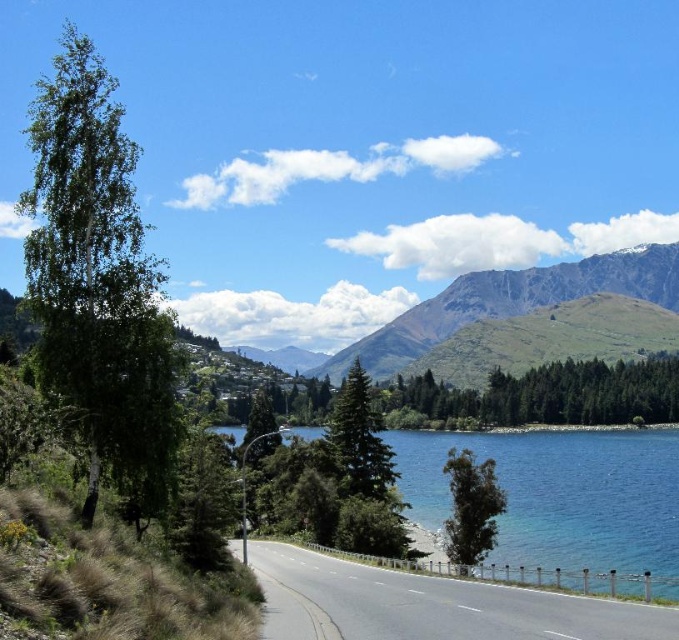
Does green matte tree at left appear on the right side of green textured mountain at upper center?

In fact, green matte tree at left is to the left of green textured mountain at upper center.

Between point (69, 234) and point (409, 340), which one is positioned behind?

Positioned behind is point (409, 340).

Who is more distant from viewer, (x=172, y=422) or (x=447, y=332)?

Positioned behind is point (x=447, y=332).

This screenshot has width=679, height=640. In order to click on green matte tree at left in this screenshot , I will do `click(98, 282)`.

Can you confirm if blue glassy water at center is bigger than green textured tree at center?

Actually, blue glassy water at center might be smaller than green textured tree at center.

Where is `blue glassy water at center`? This screenshot has width=679, height=640. blue glassy water at center is located at coordinates (562, 502).

Does blue glassy water at center appear on the left side of green textured mountain at upper center?

Yes, blue glassy water at center is to the left of green textured mountain at upper center.

Can you confirm if blue glassy water at center is positioned to the right of green textured mountain at upper center?

Incorrect, blue glassy water at center is not on the right side of green textured mountain at upper center.

Between point (657, 576) and point (386, 342), which one is positioned behind?

The point (386, 342) is more distant.

The width and height of the screenshot is (679, 640). I want to click on blue glassy water at center, so click(562, 502).